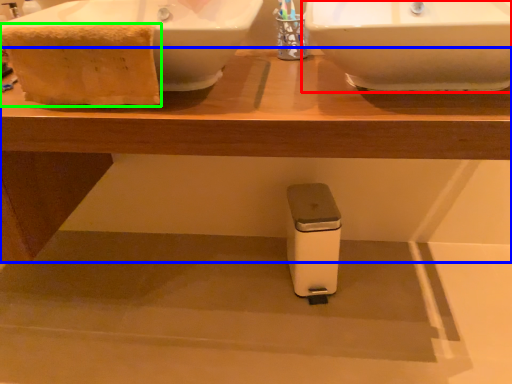
Question: Based on their relative distances, which object is farther from sink (highlighted by a red box)? Choose from table (highlighted by a blue box) and material (highlighted by a green box).

Choices:
 (A) table
 (B) material

Answer: (B)